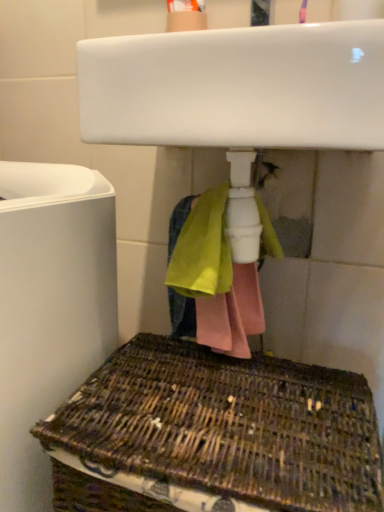
Question: Considering the relative positions of woven brown basket at lower center and white glossy sink at upper center in the image provided, is woven brown basket at lower center to the left or to the right of white glossy sink at upper center?

Choices:
 (A) right
 (B) left

Answer: (B)

Question: Considering the positions of woven brown basket at lower center and white glossy sink at upper center in the image, is woven brown basket at lower center wider or thinner than white glossy sink at upper center?

Choices:
 (A) thin
 (B) wide

Answer: (B)

Question: Which object is positioned farthest from the white glossy sink at upper center?

Choices:
 (A) woven brown basket at lower center
 (B) white matte toilet at left

Answer: (A)

Question: Estimate the real-world distances between objects in this image. Which object is closer to the white glossy sink at upper center?

Choices:
 (A) white matte toilet at left
 (B) woven brown basket at lower center

Answer: (A)